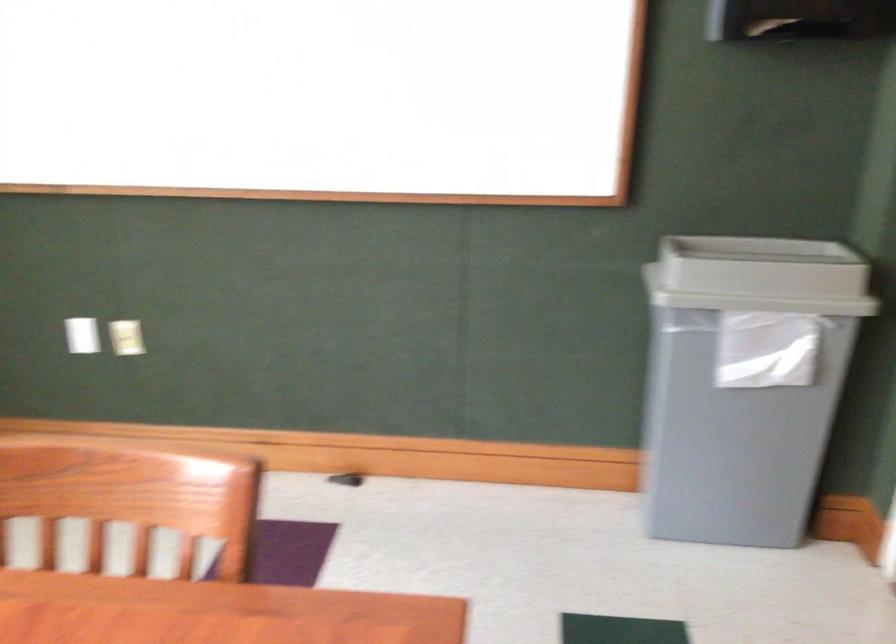
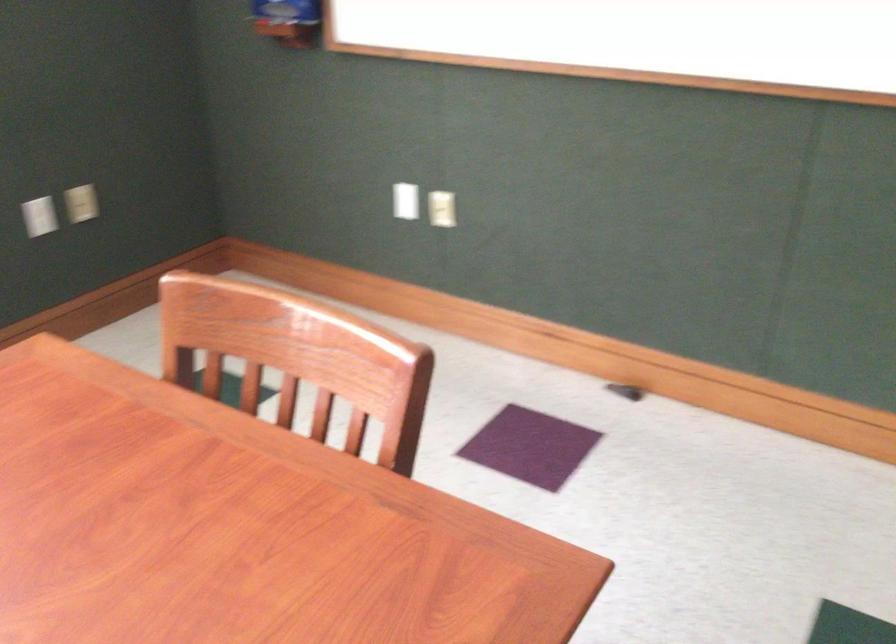
In a continuous first-person perspective shot, in which direction is the camera moving?

The cameraman moved toward right, forward.